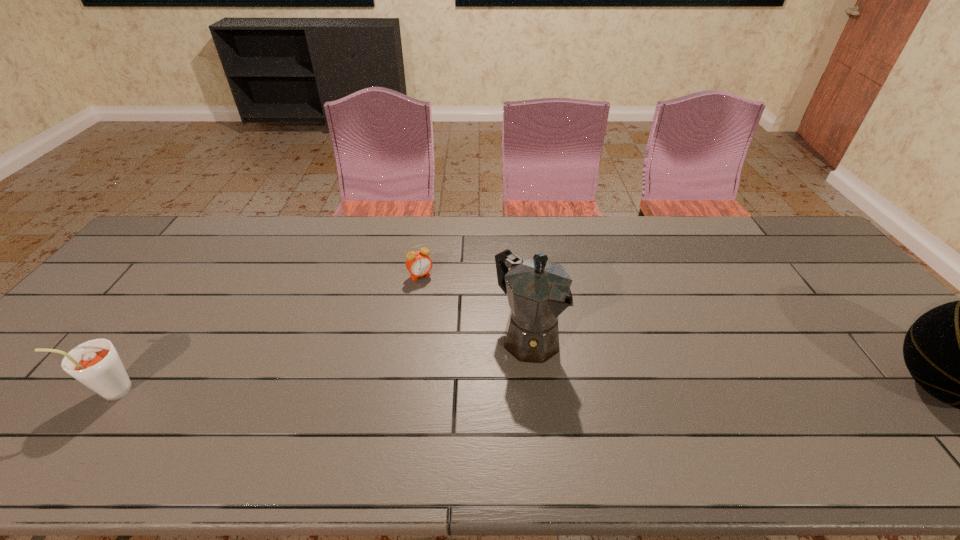
Identify the location of free spot located on the face of the third object from right to left. (439, 300).

Find the location of a particular element. The image size is (960, 540). vacant space located 0.220m on the pouring side of the coffeepot is located at coordinates (624, 420).

Identify the location of free location located 0.180m on the pouring side of the coffeepot. The height and width of the screenshot is (540, 960). (610, 408).

Where is `free space located 0.090m on the pouring side of the coffeepot`? free space located 0.090m on the pouring side of the coffeepot is located at coordinates (579, 382).

Where is `object that is at the near edge`? object that is at the near edge is located at coordinates (96, 364).

Find the location of `free space at the far edge`. free space at the far edge is located at coordinates (360, 218).

Locate an element on the screen. vacant space at the near edge of the desktop is located at coordinates (368, 409).

This screenshot has height=540, width=960. Identify the location of vacant space at the left edge. (89, 316).

The image size is (960, 540). I want to click on vacant space at the right edge of the desktop, so click(x=858, y=302).

You are a GUI agent. You are given a task and a screenshot of the screen. Output one action in this format:
    pyautogui.click(x=<x>, y=<y>)
    Task: Click on the vacant space at the far left corner
    The image size is (960, 540).
    Given the screenshot: What is the action you would take?
    pyautogui.click(x=203, y=219)